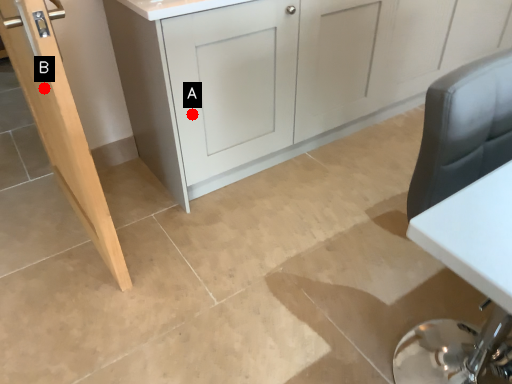
Question: Two points are circled on the image, labeled by A and B beside each circle. Which point is closer to the camera taking this photo?

Choices:
 (A) A is closer
 (B) B is closer

Answer: (B)